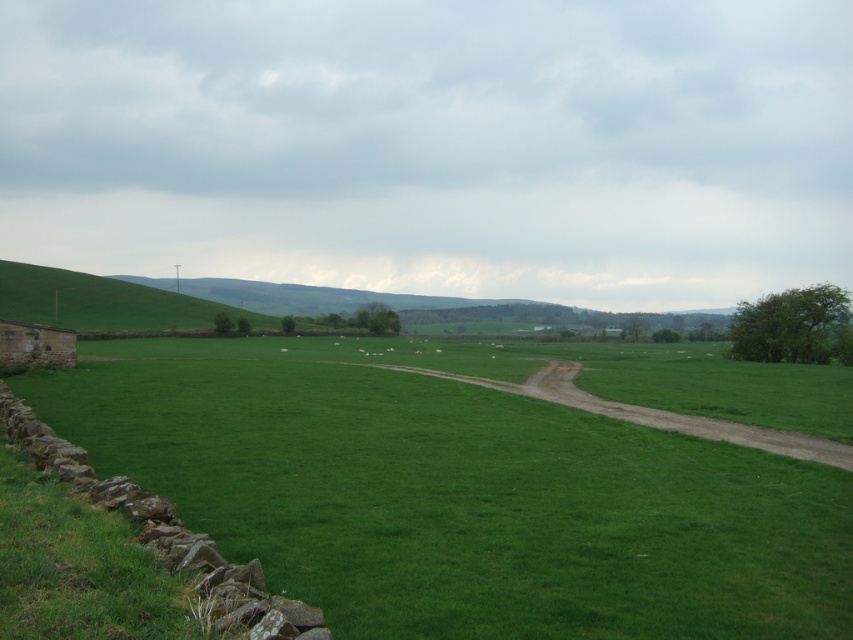
Is green grassy field at left thinner than dusty brown dirt track at center-right?

No, green grassy field at left is not thinner than dusty brown dirt track at center-right.

Which is above, green grassy field at left or dusty brown dirt track at center-right?

green grassy field at left is higher up.

Does point (548, 634) lie behind point (824, 440)?

No, it is not.

What are the coordinates of `green grassy field at left` in the screenshot? It's located at (482, 483).